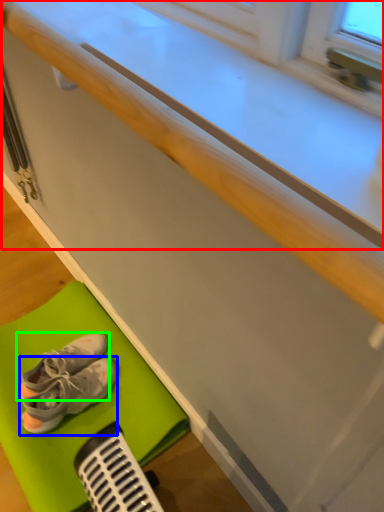
Question: Considering the real-world distances, which object is farthest from counter top (highlighted by a red box)? footwear (highlighted by a blue box) or footwear (highlighted by a green box)?

Choices:
 (A) footwear
 (B) footwear

Answer: (B)